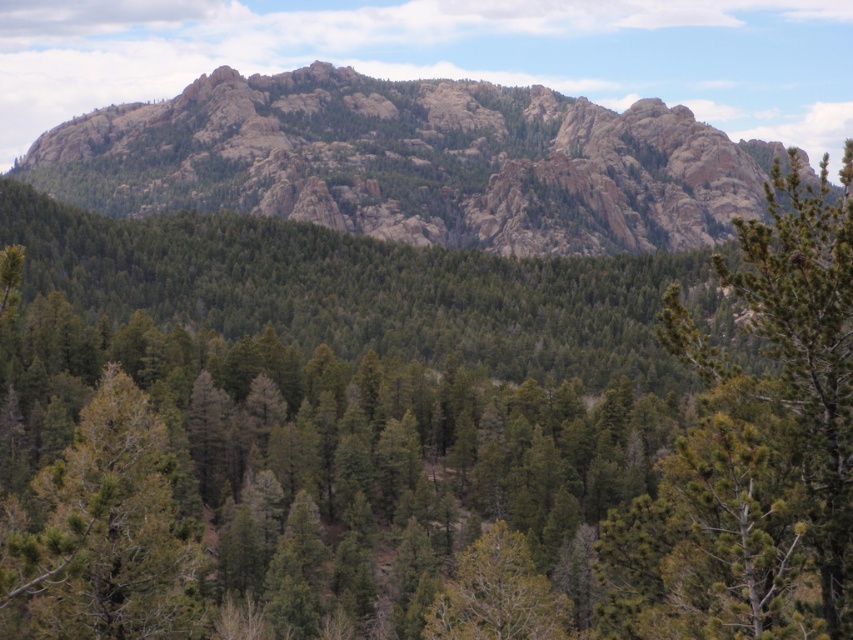
Question: Is green matte tree at lower left thinner than green matte tree at center?

Choices:
 (A) no
 (B) yes

Answer: (A)

Question: Does rugged granite mountain at upper center appear on the right side of green matte tree at center?

Choices:
 (A) no
 (B) yes

Answer: (A)

Question: Which object is farther from the camera taking this photo?

Choices:
 (A) green matte tree at center
 (B) rugged granite mountain at upper center

Answer: (B)

Question: Which object is farther from the camera taking this photo?

Choices:
 (A) rugged granite mountain at upper center
 (B) green matte tree at lower left

Answer: (A)

Question: In this image, where is rugged granite mountain at upper center located relative to green matte tree at center?

Choices:
 (A) right
 (B) left

Answer: (B)

Question: Which object is farther from the camera taking this photo?

Choices:
 (A) rugged granite mountain at upper center
 (B) green matte tree at center

Answer: (A)